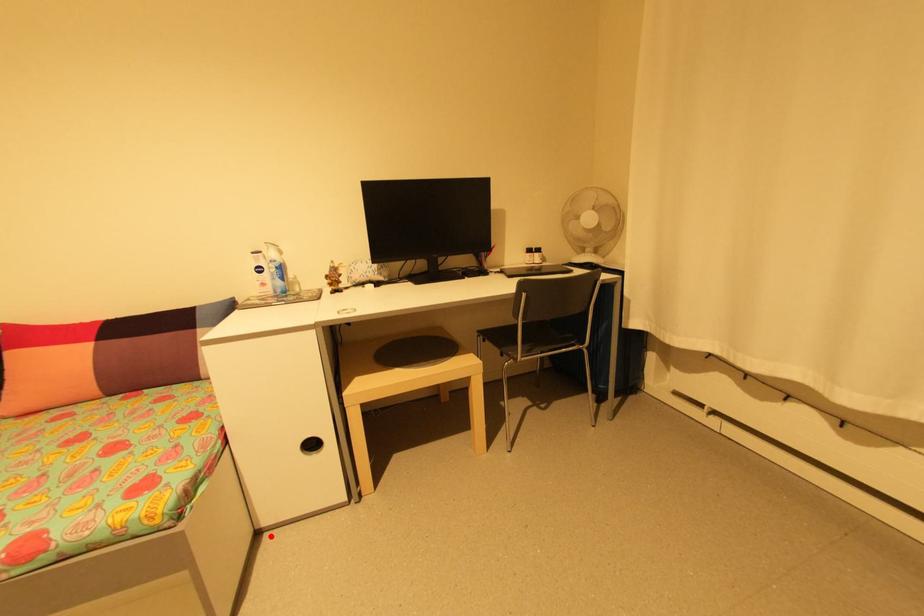
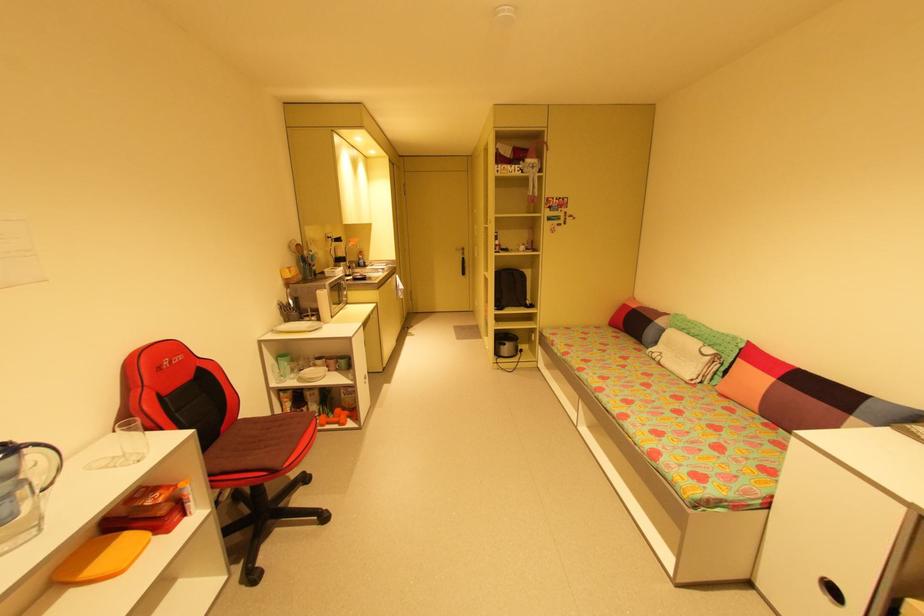
Question: I am providing you with two images of the same scene from different viewpoints. A red point is shown in image1. For the corresponding object point in image2, is it positioned nearer or farther from the camera?

Choices:
 (A) Nearer
 (B) Farther

Answer: (B)